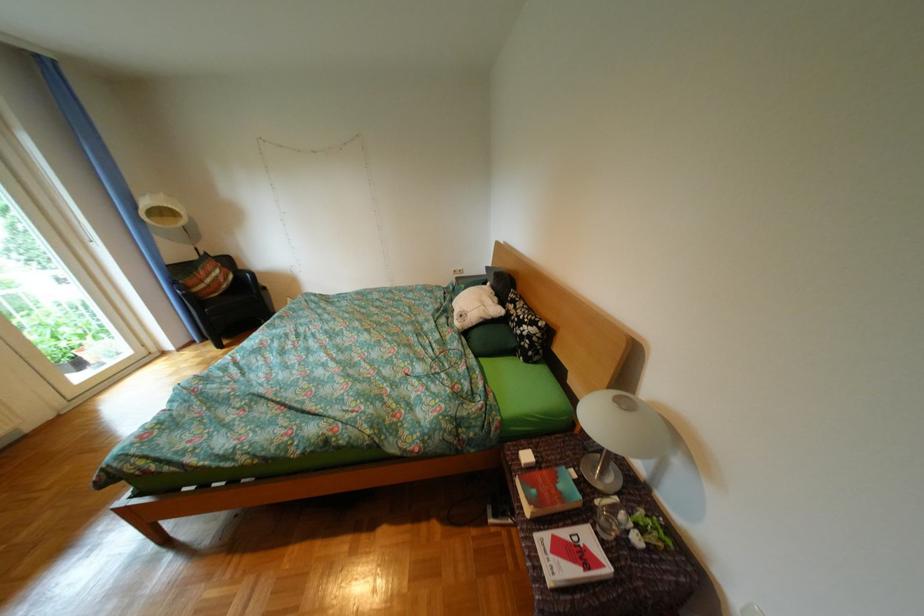
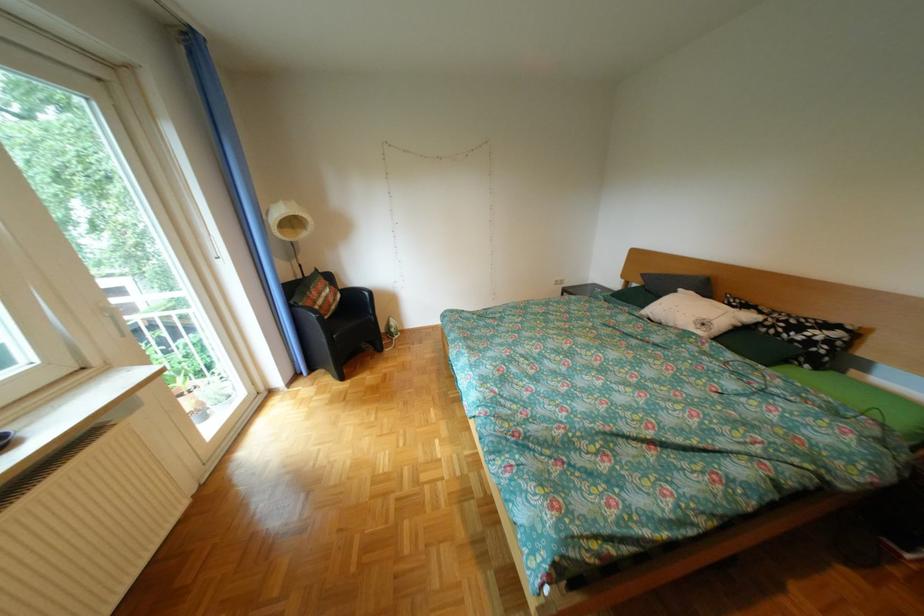
Question: Which direction would the cameraman need to move to produce the second image? Reply with the corresponding letter.

Choices:
 (A) Left
 (B) Right
 (C) Forward
 (D) Backward

Answer: (A)